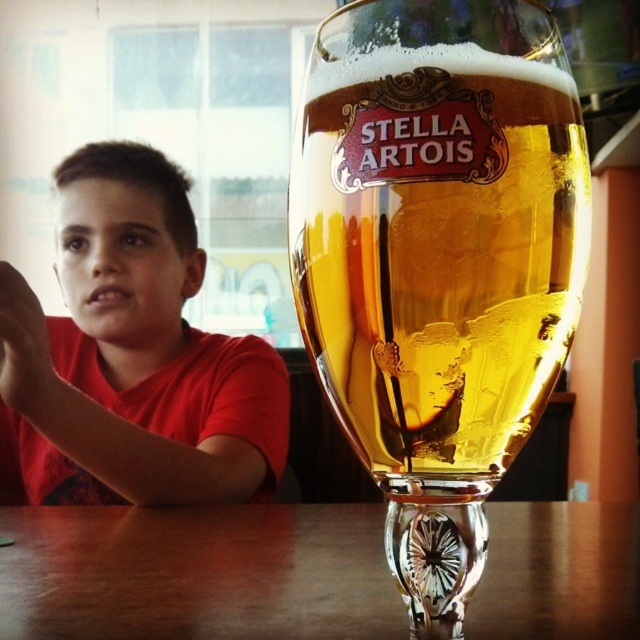
Is clear glass stella artois beer glass at center wider than wooden table at lower center?

In fact, clear glass stella artois beer glass at center might be narrower than wooden table at lower center.

Between clear glass stella artois beer glass at center and wooden table at lower center, which one is positioned higher?

clear glass stella artois beer glass at center is above.

This screenshot has width=640, height=640. Find the location of `clear glass stella artois beer glass at center`. clear glass stella artois beer glass at center is located at coordinates (436, 260).

Is point (316, 188) behind point (220, 467)?

No, it is in front of (220, 467).

Who is higher up, clear glass stella artois beer glass at center or matte red shirt at left?

clear glass stella artois beer glass at center

Who is more distant from viewer, (518,36) or (163,484)?

The point (163,484) is more distant.

Locate an element on the screen. Image resolution: width=640 pixels, height=640 pixels. clear glass stella artois beer glass at center is located at coordinates (436, 260).

Does matte red shirt at left have a smaller size compared to wooden table at lower center?

Actually, matte red shirt at left might be larger than wooden table at lower center.

Where is `matte red shirt at left`? matte red shirt at left is located at coordinates (131, 355).